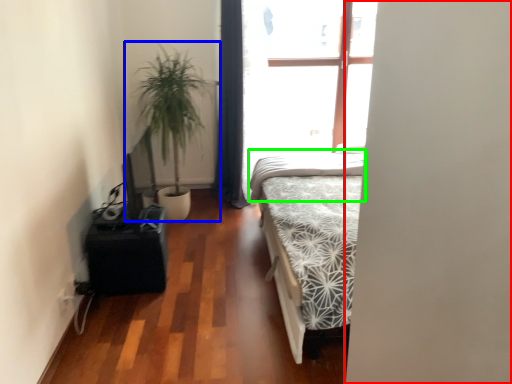
Question: Which object is positioned closest to screen door (highlighted by a red box)? Select from houseplant (highlighted by a blue box) and mattress (highlighted by a green box).

Choices:
 (A) houseplant
 (B) mattress

Answer: (B)